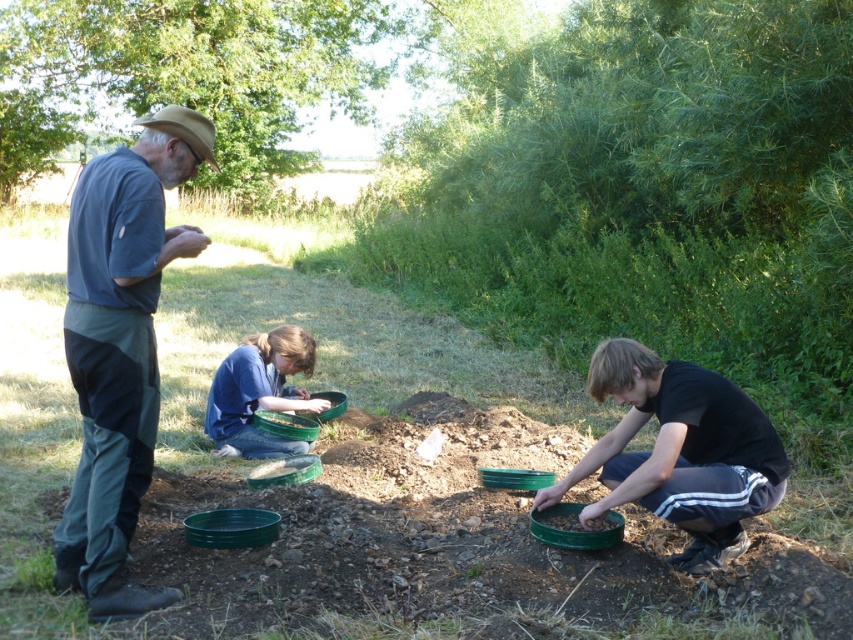
Who is higher up, blue fabric shirt at left or black matte bowl at lower right?

blue fabric shirt at left is above.

Which of these two, blue fabric shirt at left or black matte bowl at lower right, stands taller?

blue fabric shirt at left is taller.

Where is `blue fabric shirt at left`? Image resolution: width=853 pixels, height=640 pixels. blue fabric shirt at left is located at coordinates (120, 348).

Consider the image. Can you confirm if blue fabric shirt at left is smaller than blue fabric shirt at center?

Incorrect, blue fabric shirt at left is not smaller in size than blue fabric shirt at center.

Does blue fabric shirt at left have a greater height compared to blue fabric shirt at center?

Correct, blue fabric shirt at left is much taller as blue fabric shirt at center.

Is point (131, 157) farther from camera compared to point (271, 349)?

No, it is not.

Where is `blue fabric shirt at left`? blue fabric shirt at left is located at coordinates (120, 348).

Who is more distant from viewer, (618, 492) or (280, 403)?

The point (280, 403) is more distant.

Can you confirm if black matte bowl at lower right is positioned below blue fabric shirt at center?

Yes.

Is point (746, 460) less distant than point (252, 428)?

Yes, it is.

Where is `black matte bowl at lower right`? The width and height of the screenshot is (853, 640). black matte bowl at lower right is located at coordinates (680, 451).